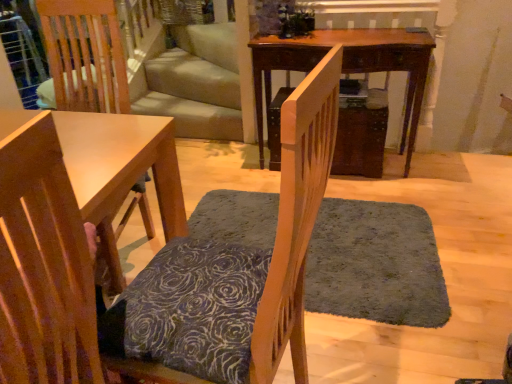
At what (x,y) coordinates should I click in order to perform the action: click on vacant area that is in front of mahogany wood table at center. Please return your answer as a coordinate pair (x, y). This screenshot has width=512, height=384. Looking at the image, I should click on (386, 199).